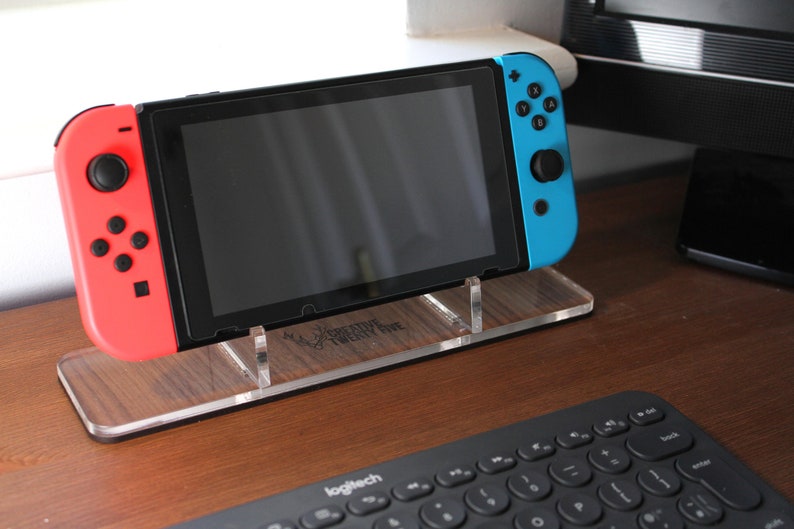
Find the location of a particular element. The image size is (794, 529). wall is located at coordinates (190, 39).